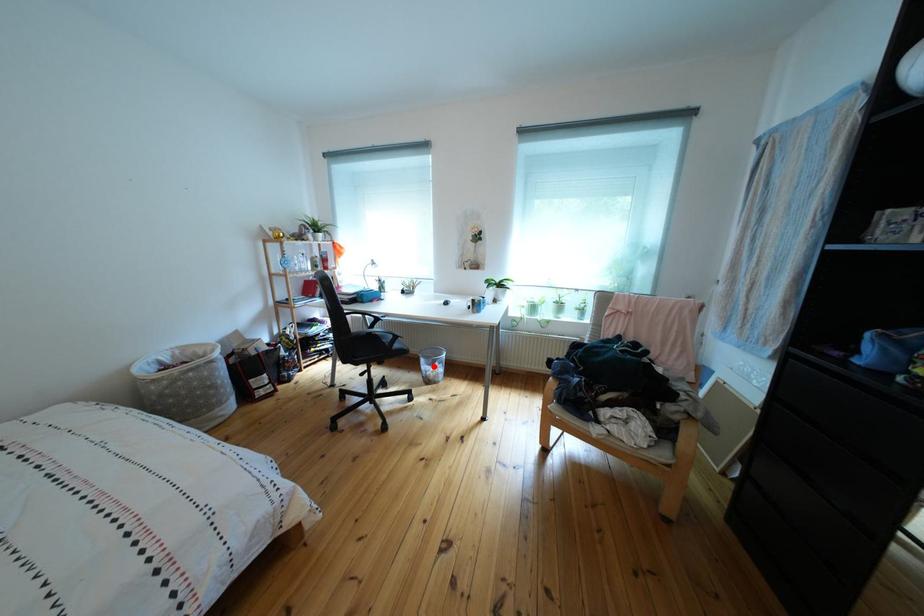
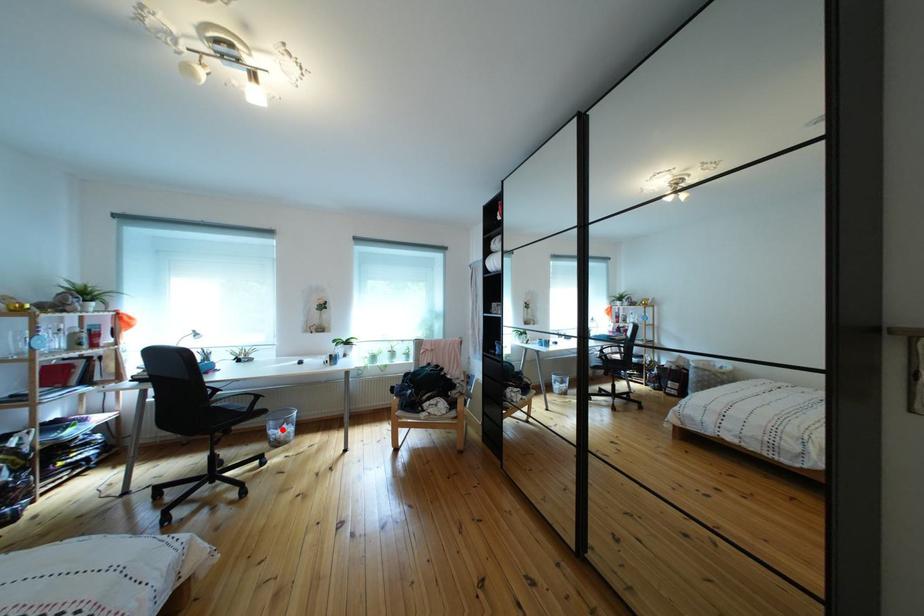
I am providing you with two images of the same scene from different viewpoints. A red point is marked on the first image and another point is marked on the second image. Does the point marked in image1 correspond to the same location as the one in image2?

Yes